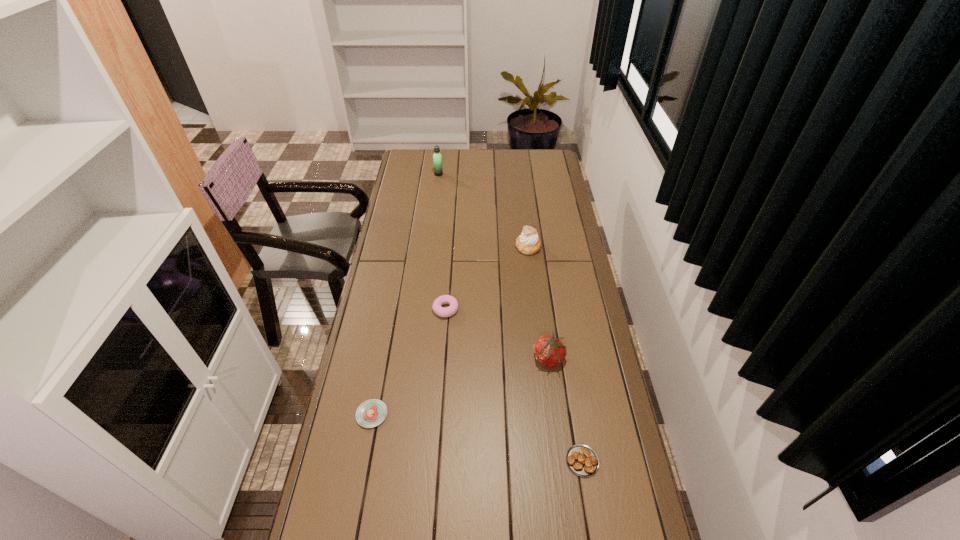
Locate an element on the screen. vacant space that is in between the fifth nearest object and the third shortest object is located at coordinates (487, 278).

Find the location of a particular element. empty space that is in between the tallest pastry and the tallest object is located at coordinates (483, 211).

You are a GUI agent. You are given a task and a screenshot of the screen. Output one action in this format:
    pyautogui.click(x=<x>, y=<y>)
    Task: Click on the free space between the third farthest object and the tomato
    The width and height of the screenshot is (960, 540).
    Given the screenshot: What is the action you would take?
    pyautogui.click(x=497, y=334)

Choose which object is the third nearest neighbor to the nearest pastry. Please provide its 2D coordinates. Your answer should be formatted as a tuple, i.e. [(x, y)], where the tuple contains the x and y coordinates of a point satisfying the conditions above.

[(437, 307)]

This screenshot has width=960, height=540. I want to click on object that is the fourth closest one to the fourth object from right to left, so click(582, 460).

What are the coordinates of `pastry that is the closest to the farthest pastry` in the screenshot? It's located at (437, 307).

Point out which pastry is positioned as the nearest to the nearest object. Please provide its 2D coordinates. Your answer should be formatted as a tuple, i.e. [(x, y)], where the tuple contains the x and y coordinates of a point satisfying the conditions above.

[(371, 413)]

Identify the location of free spot that satisfies the following two spatial constraints: 1. on the back side of the tallest pastry; 2. on the right side of the leftmost object. (403, 247).

Where is `vacant space that satisfies the following two spatial constraints: 1. on the front side of the fourth nearest object; 2. on the left side of the third tallest object`? The height and width of the screenshot is (540, 960). vacant space that satisfies the following two spatial constraints: 1. on the front side of the fourth nearest object; 2. on the left side of the third tallest object is located at coordinates (443, 359).